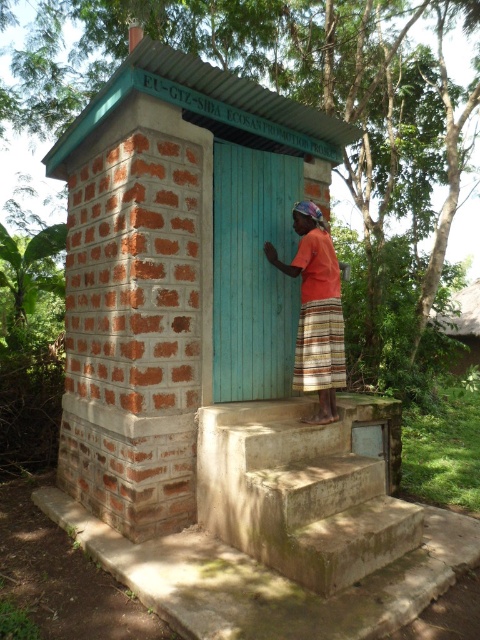
Is brick hut at center in front of orange cotton shirt at center?

Yes, brick hut at center is in front of orange cotton shirt at center.

What do you see at coordinates (176, 272) in the screenshot? The height and width of the screenshot is (640, 480). I see `brick hut at center` at bounding box center [176, 272].

Locate an element on the screen. brick hut at center is located at coordinates (176, 272).

Between brick hut at center and concrete stairs at center, which one has less height?

concrete stairs at center

Is brick hut at center wider than concrete stairs at center?

Correct, the width of brick hut at center exceeds that of concrete stairs at center.

Does point (194, 104) lie in front of point (319, 544)?

That is False.

Find the location of `brick hut at center`. brick hut at center is located at coordinates [x=176, y=272].

Which is more to the right, concrete stairs at center or orange cotton shirt at center?

From the viewer's perspective, orange cotton shirt at center appears more on the right side.

Does concrete stairs at center have a lesser height compared to orange cotton shirt at center?

Correct, concrete stairs at center is not as tall as orange cotton shirt at center.

Between point (322, 500) and point (336, 369), which one is positioned in front?

Point (322, 500) is in front.

Image resolution: width=480 pixels, height=640 pixels. In order to click on concrete stairs at center in this screenshot , I will do `click(304, 488)`.